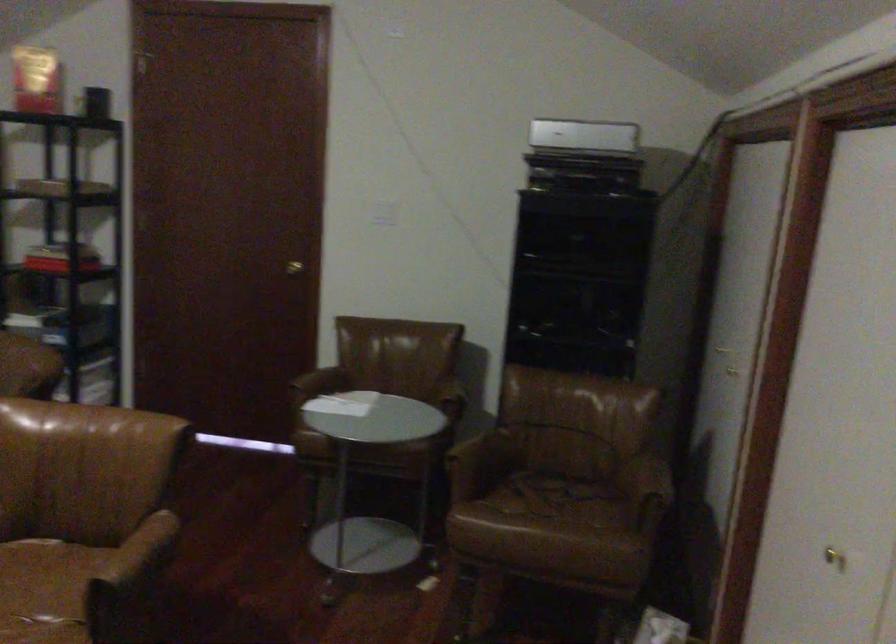
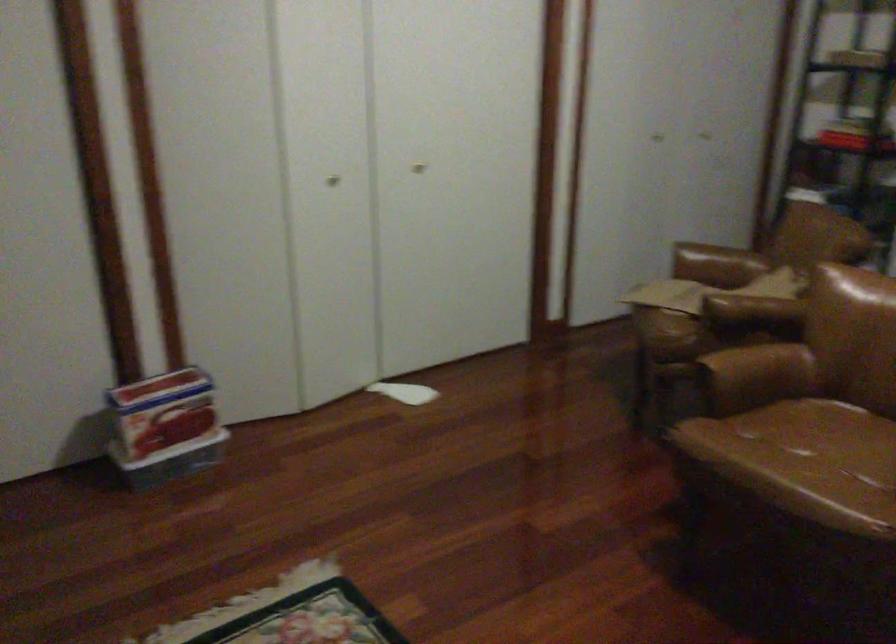
Question: The images are taken continuously from a first-person perspective. In which direction is your viewpoint rotating?

Choices:
 (A) Left
 (B) Right
 (C) Up
 (D) Down

Answer: (A)